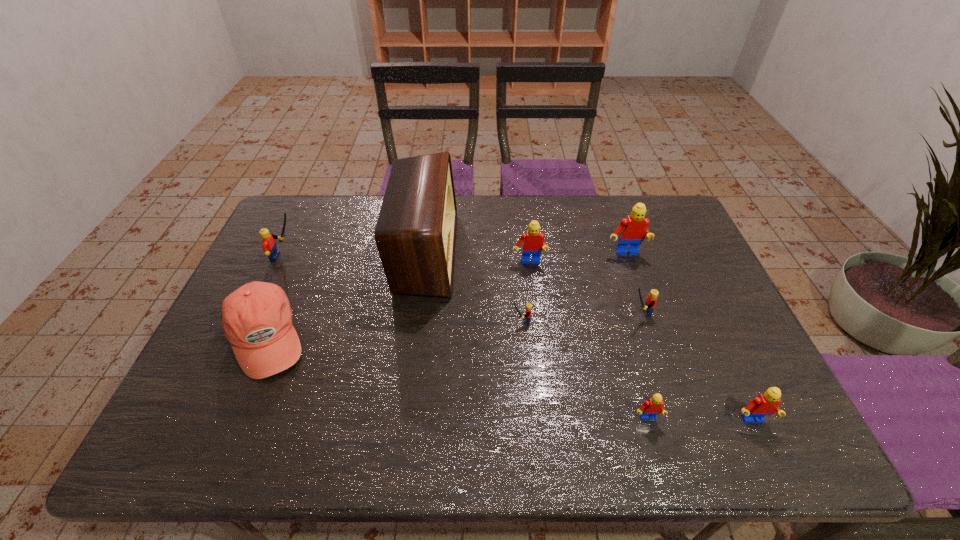
Where is `radio receiver`? The width and height of the screenshot is (960, 540). radio receiver is located at coordinates (415, 234).

The image size is (960, 540). Identify the location of the tallest object. (415, 234).

Identify the location of the biggest red Lego. (632, 230).

At what (x,y) coordinates should I click in order to perform the action: click on the eighth shortest object. Please return your answer as a coordinate pair (x, y). The height and width of the screenshot is (540, 960). Looking at the image, I should click on (632, 230).

Image resolution: width=960 pixels, height=540 pixels. In order to click on the farthest yellow Lego in this screenshot , I will do `click(268, 243)`.

This screenshot has height=540, width=960. I want to click on the leftmost Lego, so click(x=268, y=243).

I want to click on the leftmost red Lego, so click(532, 241).

At what (x,y) coordinates should I click in order to perform the action: click on baseball cap. Please return your answer as a coordinate pair (x, y). Looking at the image, I should click on (257, 318).

You are a GUI agent. You are given a task and a screenshot of the screen. Output one action in this format:
    pyautogui.click(x=<x>, y=<y>)
    Task: Click on the rightmost yellow Lego
    Image resolution: width=960 pixels, height=540 pixels.
    Given the screenshot: What is the action you would take?
    click(x=650, y=302)

The width and height of the screenshot is (960, 540). Identify the location of the third biggest red Lego. (766, 404).